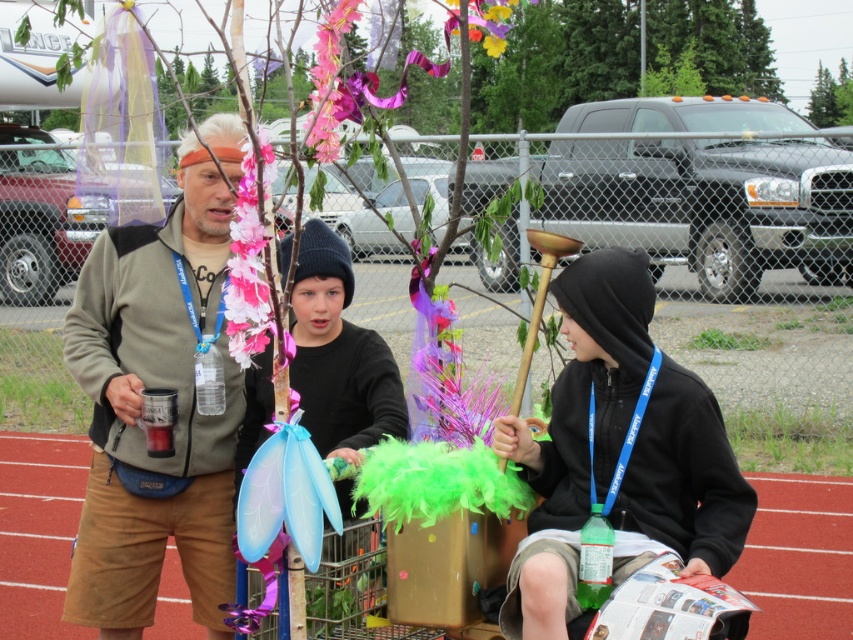
Question: Which of the following is the closest to the observer?

Choices:
 (A) (674, 413)
 (B) (303, 304)
 (C) (169, 225)

Answer: (A)

Question: Is matte gray hoodie at center below black matte jacket at center?

Choices:
 (A) no
 (B) yes

Answer: (B)

Question: Which object appears closest to the camera in this image?

Choices:
 (A) black matte jacket at center
 (B) matte gray hoodie at center

Answer: (A)

Question: Where is black fleece hoodie at center located in relation to black matte jacket at center in the image?

Choices:
 (A) right
 (B) left

Answer: (A)

Question: Does matte gray hoodie at center have a greater width compared to black fleece hoodie at center?

Choices:
 (A) no
 (B) yes

Answer: (B)

Question: Among these objects, which one is farthest from the camera?

Choices:
 (A) black matte jacket at center
 (B) black fleece hoodie at center
 (C) matte gray hoodie at center

Answer: (B)